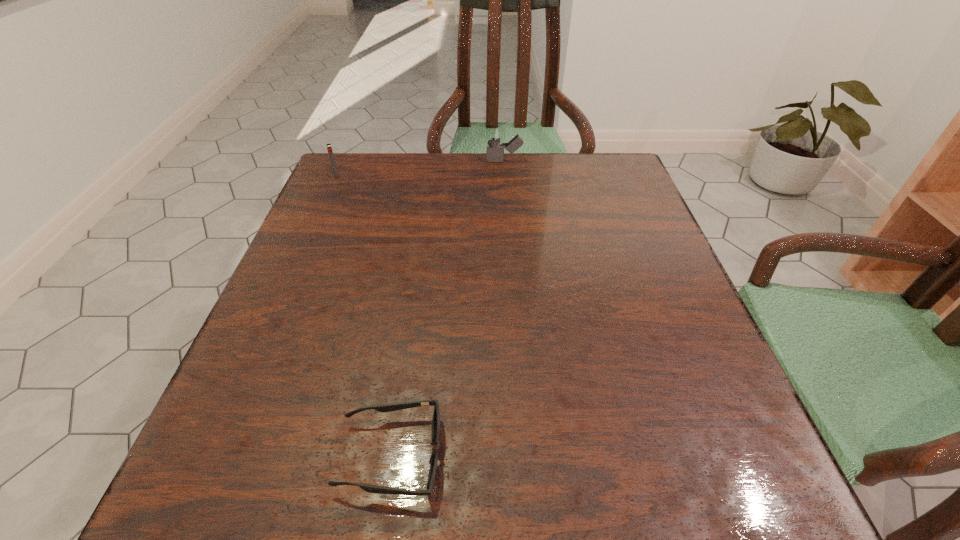
This screenshot has height=540, width=960. What are the coordinates of `the taller igniter` in the screenshot? It's located at (495, 134).

The image size is (960, 540). I want to click on the tallest object, so click(495, 134).

What are the coordinates of `the shorter igniter` in the screenshot? It's located at (329, 148).

This screenshot has width=960, height=540. In order to click on the second nearest object in this screenshot , I will do `click(329, 148)`.

Identify the location of the nearest object. The width and height of the screenshot is (960, 540). (433, 460).

Locate an element on the screen. This screenshot has width=960, height=540. sunglasses is located at coordinates (433, 460).

The image size is (960, 540). In order to click on free region located on the right of the farther igniter in this screenshot , I will do `click(583, 161)`.

This screenshot has height=540, width=960. What are the coordinates of `vacant space situated 0.270m on the front of the shorter igniter` in the screenshot? It's located at (304, 246).

Locate an element on the screen. The image size is (960, 540). blank space located on the front-facing side of the shortest object is located at coordinates (515, 456).

At what (x,y) coordinates should I click in order to perform the action: click on object that is at the near edge. Please return your answer as a coordinate pair (x, y). The height and width of the screenshot is (540, 960). Looking at the image, I should click on (433, 460).